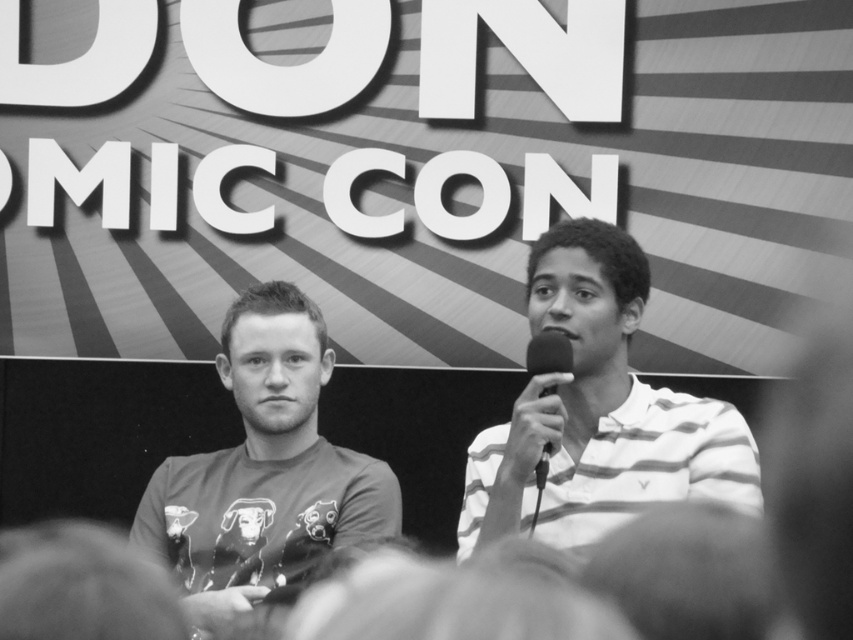
You are standing in front of the image. The striped cotton shirt at right is located at which coordinate point?

The striped cotton shirt at right is located at coordinate point (598,412).